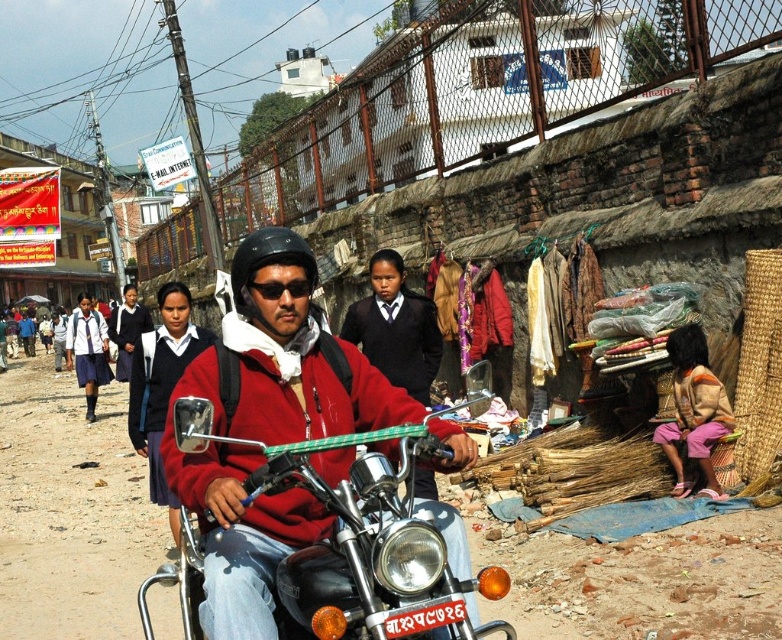
You are standing at the point with coordinates point (659, 440) and want to move to the point with coordinates point (162, 474). Which direction should you move in?

You should move downward and to the right because point (162, 474) is behind point (659, 440), meaning it is located in the lower right direction relative to your current position.

You are standing at the point with coordinates point (271, 611) and want to move towards the point with coordinates point (85, 374). Since you can only move forward, will you get closer to the motorcycle or farther away from it?

Point (271, 611) is closer to the viewer than point (85, 374). Therefore, moving from point (271, 611) towards point (85, 374) would mean moving away from the viewer, which would take you farther away from the motorcycle since the motorcycle is in the foreground.